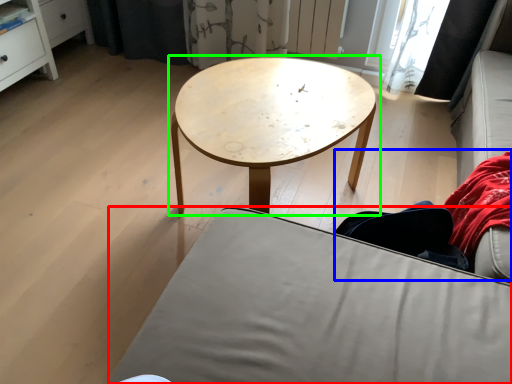
Question: Which object is positioned farthest from studio couch (highlighted by a red box)? Select from couple (highlighted by a blue box) and coffee table (highlighted by a green box).

Choices:
 (A) couple
 (B) coffee table

Answer: (B)